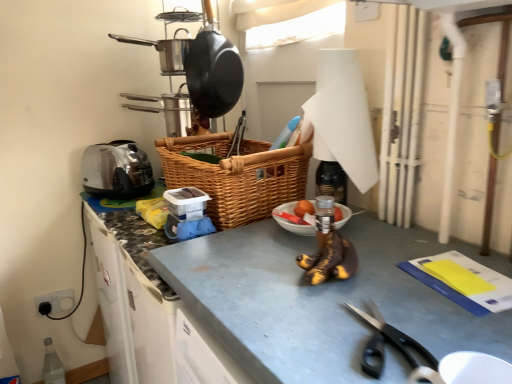
Image resolution: width=512 pixels, height=384 pixels. Identify the location of vacant area to the right of black plastic scissors at lower right. (450, 324).